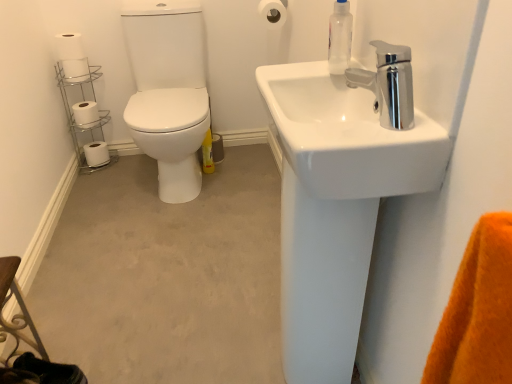
The image size is (512, 384). I want to click on white matte toilet paper at upper left, the 5th toilet paper when ordered from bottom to top, so click(x=69, y=46).

The height and width of the screenshot is (384, 512). I want to click on white matte toilet paper at left, which is the second toilet paper in bottom-to-top order, so click(x=86, y=114).

This screenshot has height=384, width=512. What do you see at coordinates (353, 129) in the screenshot? I see `white glossy sink at upper right` at bounding box center [353, 129].

Describe the element at coordinates (96, 154) in the screenshot. I see `white matte toilet paper at lower left, the fifth toilet paper viewed from the top` at that location.

The image size is (512, 384). What are the coordinates of `white matte toilet paper at upper left, arranged as the 2th toilet paper when viewed from the front` in the screenshot? It's located at (69, 46).

In terms of width, does white matte toilet paper at left, the second toilet paper in the left-to-right sequence, look wider or thinner when compared to white glossy sink at upper right?

white matte toilet paper at left, the second toilet paper in the left-to-right sequence, is thinner than white glossy sink at upper right.

Could you tell me if white matte toilet paper at left, which is the second toilet paper in bottom-to-top order, is facing white glossy sink at upper right?

No, white matte toilet paper at left, which is the second toilet paper in bottom-to-top order, is not facing towards white glossy sink at upper right.

From a real-world perspective, which is physically below, white matte toilet paper at left, which appears as the fourth toilet paper when viewed from the front, or white glossy sink at upper right?

white matte toilet paper at left, which appears as the fourth toilet paper when viewed from the front, from a real-world perspective.

Is white matte toilet paper at left, the fourth toilet paper positioned from the top, with white glossy sink at upper right?

There is a gap between white matte toilet paper at left, the fourth toilet paper positioned from the top, and white glossy sink at upper right.

Based on the photo, which of these two, chrome metallic faucet at upper right or white matte toilet paper at left, which appears as the fourth toilet paper when viewed from the front, is wider?

white matte toilet paper at left, which appears as the fourth toilet paper when viewed from the front, is wider.

Is chrome metallic faucet at upper right positioned beyond the bounds of white matte toilet paper at left, which is the second toilet paper in bottom-to-top order?

Yes.

How far apart are chrome metallic faucet at upper right and white matte toilet paper at left, the fourth toilet paper positioned from the top?

chrome metallic faucet at upper right and white matte toilet paper at left, the fourth toilet paper positioned from the top, are 1.78 meters apart.

Is point (397, 118) positioned after point (94, 125)?

No, (397, 118) is in front of (94, 125).

Measure the distance between white glossy sink at upper right and white matte toilet paper at upper center, which appears as the 1th toilet paper when viewed from the front.

white glossy sink at upper right and white matte toilet paper at upper center, which appears as the 1th toilet paper when viewed from the front, are 36.40 inches apart from each other.

From the image's perspective, which is below, white glossy sink at upper right or white matte toilet paper at upper center, which is the 2th toilet paper from top to bottom?

white glossy sink at upper right is shown below in the image.

In the image, is white glossy sink at upper right positioned in front of or behind white matte toilet paper at upper center, marked as the 4th toilet paper in a bottom-to-top arrangement?

Clearly, white glossy sink at upper right is in front of white matte toilet paper at upper center, marked as the 4th toilet paper in a bottom-to-top arrangement.

Considering the sizes of white glossy sink at upper right and white matte toilet paper at upper center, which is the 2th toilet paper from top to bottom, in the image, is white glossy sink at upper right wider or thinner than white matte toilet paper at upper center, which is the 2th toilet paper from top to bottom,?

Considering their sizes, white glossy sink at upper right looks broader than white matte toilet paper at upper center, which is the 2th toilet paper from top to bottom.

Is point (106, 158) closer to camera compared to point (360, 168)?

No, it is behind (360, 168).

Is white matte toilet paper at lower left, the 1th toilet paper from the left, not near white glossy sink at upper right?

Yes.

Does white matte toilet paper at lower left, the 5th toilet paper in the front-to-back sequence, have a greater width compared to white glossy sink at upper right?

Incorrect, the width of white matte toilet paper at lower left, the 5th toilet paper in the front-to-back sequence, does not surpass that of white glossy sink at upper right.

The image size is (512, 384). There is a white glossy sink at upper right. In order to click on the 4th toilet paper below it (from a real-world perspective) in this screenshot , I will do `click(96, 154)`.

Considering the sizes of objects chrome metallic faucet at upper right and white glossy sink at upper right in the image provided, who is smaller, chrome metallic faucet at upper right or white glossy sink at upper right?

chrome metallic faucet at upper right is smaller.

From the image's perspective, is chrome metallic faucet at upper right over white glossy sink at upper right?

Correct, chrome metallic faucet at upper right appears higher than white glossy sink at upper right in the image.

Is chrome metallic faucet at upper right outside of white glossy sink at upper right?

chrome metallic faucet at upper right is positioned outside white glossy sink at upper right.

Which is in front, point (274, 22) or point (91, 163)?

Positioned in front is point (274, 22).

Is white matte toilet paper at upper center, the 1th toilet paper from the right, looking in the opposite direction of white matte toilet paper at lower left, marked as the 1th toilet paper in a bottom-to-top arrangement?

white matte toilet paper at upper center, the 1th toilet paper from the right, does not have its back to white matte toilet paper at lower left, marked as the 1th toilet paper in a bottom-to-top arrangement.

The height and width of the screenshot is (384, 512). What are the coordinates of `the 4th toilet paper to the right of the white matte toilet paper at lower left, marked as the 1th toilet paper in a bottom-to-top arrangement, counting from the anchor's position` in the screenshot? It's located at (273, 13).

Is white matte toilet paper at upper center, marked as the 4th toilet paper in a bottom-to-top arrangement, with white matte toilet paper at lower left, the fifth toilet paper viewed from the top?

white matte toilet paper at upper center, marked as the 4th toilet paper in a bottom-to-top arrangement, and white matte toilet paper at lower left, the fifth toilet paper viewed from the top, are clearly separated.

Measure the distance from white matte toilet paper at lower left, the 5th toilet paper in the front-to-back sequence, to white matte toilet paper at upper left, placed as the 3th toilet paper when sorted from top to bottom.

white matte toilet paper at lower left, the 5th toilet paper in the front-to-back sequence, is 15.47 inches from white matte toilet paper at upper left, placed as the 3th toilet paper when sorted from top to bottom.

From the image's perspective, between white matte toilet paper at lower left, the fifth toilet paper in the right-to-left sequence, and white matte toilet paper at upper left, marked as the third toilet paper in a front-to-back arrangement, who is located below?

white matte toilet paper at lower left, the fifth toilet paper in the right-to-left sequence, appears lower in the image.

Image resolution: width=512 pixels, height=384 pixels. Identify the location of the 2nd toilet paper positioned below the white matte toilet paper at upper left, which ranks as the third toilet paper in right-to-left order (from the image's perspective). (96, 154).

Is white matte toilet paper at lower left, the 5th toilet paper in the front-to-back sequence, thinner than white matte toilet paper at upper left, placed as the 3th toilet paper when sorted from top to bottom?

No.

Where is `sink on the right of white matte toilet paper at left, which appears as the fourth toilet paper when viewed from the front`? sink on the right of white matte toilet paper at left, which appears as the fourth toilet paper when viewed from the front is located at coordinates (353, 129).

Locate an element on the screen. This screenshot has width=512, height=384. tap that appears above the white matte toilet paper at left, the second toilet paper in the back-to-front sequence (from a real-world perspective) is located at coordinates (388, 85).

Estimate the real-world distances between objects in this image. Which object is closer to chrome metallic faucet at upper right, white matte toilet paper at lower left, the fifth toilet paper viewed from the top, or transparent plastic soap dispenser at upper right?

Based on the image, transparent plastic soap dispenser at upper right appears to be nearer to chrome metallic faucet at upper right.

When comparing their distances from white matte toilet paper at left, which appears as the fourth toilet paper when viewed from the front, does white matte toilet paper at upper left, placed as the 3th toilet paper when sorted from top to bottom, or white matte toilet paper at upper left, arranged as the 2th toilet paper when viewed from the front, seem further?

The object further to white matte toilet paper at left, which appears as the fourth toilet paper when viewed from the front, is white matte toilet paper at upper left, arranged as the 2th toilet paper when viewed from the front.

Which object lies nearer to the anchor point white matte toilet paper at upper center, arranged as the 5th toilet paper when viewed from the back, chrome/metallic toilet paper holder at left or white matte toilet paper at upper left, which is the 3th toilet paper in bottom-to-top order?

Among the two, white matte toilet paper at upper left, which is the 3th toilet paper in bottom-to-top order, is located nearer to white matte toilet paper at upper center, arranged as the 5th toilet paper when viewed from the back.

Based on their spatial positions, is chrome metallic faucet at upper right or white matte toilet paper at lower left, the 5th toilet paper in the front-to-back sequence, further from white glossy sink at upper right?

The object further to white glossy sink at upper right is white matte toilet paper at lower left, the 5th toilet paper in the front-to-back sequence.

Estimate the real-world distances between objects in this image. Which object is further from chrome metallic faucet at upper right, white matte toilet paper at upper left, arranged as the 2th toilet paper when viewed from the front, or white matte toilet paper at upper left, marked as the third toilet paper in a front-to-back arrangement?

white matte toilet paper at upper left, arranged as the 2th toilet paper when viewed from the front, is further to chrome metallic faucet at upper right.

From the image, which object appears to be farther from white matte toilet paper at left, which ranks as the fourth toilet paper in right-to-left order, transparent plastic soap dispenser at upper right or white matte toilet paper at upper center, the fifth toilet paper from the left?

transparent plastic soap dispenser at upper right is further to white matte toilet paper at left, which ranks as the fourth toilet paper in right-to-left order.

Based on their spatial positions, is white matte toilet paper at upper left, the fourth toilet paper viewed from the left, or white matte toilet paper at lower left, the fifth toilet paper viewed from the top, closer to white matte toilet paper at upper left, which is the 3th toilet paper in bottom-to-top order?

Among the two, white matte toilet paper at upper left, the fourth toilet paper viewed from the left, is located nearer to white matte toilet paper at upper left, which is the 3th toilet paper in bottom-to-top order.

Which object lies nearer to the anchor point white matte toilet paper at lower left, the 5th toilet paper in the front-to-back sequence, white matte toilet paper at upper center, arranged as the 5th toilet paper when viewed from the back, or transparent plastic soap dispenser at upper right?

white matte toilet paper at upper center, arranged as the 5th toilet paper when viewed from the back, lies closer to white matte toilet paper at lower left, the 5th toilet paper in the front-to-back sequence, than the other object.

Where is `soap dispenser between white glossy sink at upper right and white matte toilet paper at upper center, the 1th toilet paper from the right, in the front-back direction`? Image resolution: width=512 pixels, height=384 pixels. soap dispenser between white glossy sink at upper right and white matte toilet paper at upper center, the 1th toilet paper from the right, in the front-back direction is located at coordinates (340, 37).

Where is `toilet paper between chrome metallic faucet at upper right and white matte toilet paper at upper left, arranged as the 2th toilet paper when viewed from the front, from front to back`? The width and height of the screenshot is (512, 384). toilet paper between chrome metallic faucet at upper right and white matte toilet paper at upper left, arranged as the 2th toilet paper when viewed from the front, from front to back is located at coordinates point(273,13).

Where is `shelf between white glossy sink at upper right and white matte toilet paper at left, which ranks as the fourth toilet paper in right-to-left order, in the front-back direction`? The width and height of the screenshot is (512, 384). shelf between white glossy sink at upper right and white matte toilet paper at left, which ranks as the fourth toilet paper in right-to-left order, in the front-back direction is located at coordinates (88, 122).

You are a GUI agent. You are given a task and a screenshot of the screen. Output one action in this format:
    pyautogui.click(x=<x>, y=<y>)
    Task: Click on the toilet paper situated between white matte toilet paper at upper left, positioned as the second toilet paper in right-to-left order, and transparent plastic soap dispenser at upper right from left to right
    The image size is (512, 384).
    Given the screenshot: What is the action you would take?
    pyautogui.click(x=273, y=13)